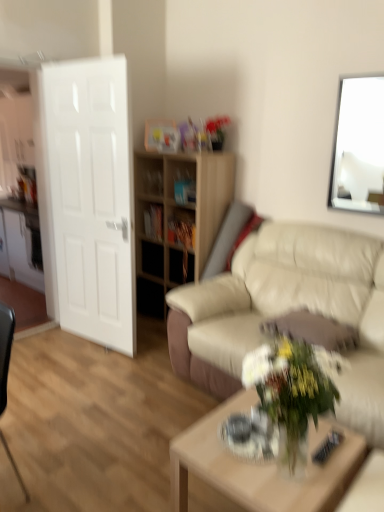
Question: Is beige leather couch at center facing away from white glossy door at left?

Choices:
 (A) yes
 (B) no

Answer: (B)

Question: From the image's perspective, does beige leather couch at center appear lower than white glossy door at left?

Choices:
 (A) yes
 (B) no

Answer: (A)

Question: Can you confirm if beige leather couch at center is positioned to the right of white glossy door at left?

Choices:
 (A) yes
 (B) no

Answer: (A)

Question: Is white glossy door at left completely or partially inside beige leather couch at center?

Choices:
 (A) no
 (B) yes

Answer: (A)

Question: From the image's perspective, would you say beige leather couch at center is positioned over white glossy door at left?

Choices:
 (A) yes
 (B) no

Answer: (B)

Question: Relative to light wood shelf at center, is beige leather couch at center in front or behind?

Choices:
 (A) front
 (B) behind

Answer: (A)

Question: Is point (193, 306) positioned closer to the camera than point (150, 187)?

Choices:
 (A) farther
 (B) closer

Answer: (B)

Question: In the image, is beige leather couch at center on the left side or the right side of light wood shelf at center?

Choices:
 (A) right
 (B) left

Answer: (A)

Question: From a real-world perspective, is beige leather couch at center physically located above or below light wood shelf at center?

Choices:
 (A) below
 (B) above

Answer: (A)

Question: Is light wood/texture coffee table at center wider or thinner than white glossy door at left?

Choices:
 (A) wide
 (B) thin

Answer: (A)

Question: In terms of height, does light wood/texture coffee table at center look taller or shorter compared to white glossy door at left?

Choices:
 (A) tall
 (B) short

Answer: (B)

Question: From a real-world perspective, is light wood/texture coffee table at center physically located above or below white glossy door at left?

Choices:
 (A) below
 (B) above

Answer: (A)

Question: Choose the correct answer: Is light wood/texture coffee table at center inside white glossy door at left or outside it?

Choices:
 (A) inside
 (B) outside

Answer: (B)

Question: Considering the relative positions of white glossy door at left and white glossy picture frame at upper right in the image provided, is white glossy door at left to the left or to the right of white glossy picture frame at upper right?

Choices:
 (A) right
 (B) left

Answer: (B)

Question: In the image, is white glossy door at left positioned in front of or behind white glossy picture frame at upper right?

Choices:
 (A) front
 (B) behind

Answer: (B)